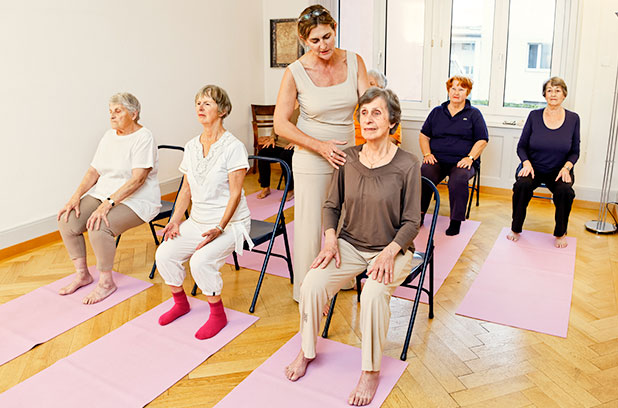
Locate an element on the screen. Image resolution: width=618 pixels, height=408 pixels. chair is located at coordinates (167, 208), (261, 226), (418, 267), (476, 181).